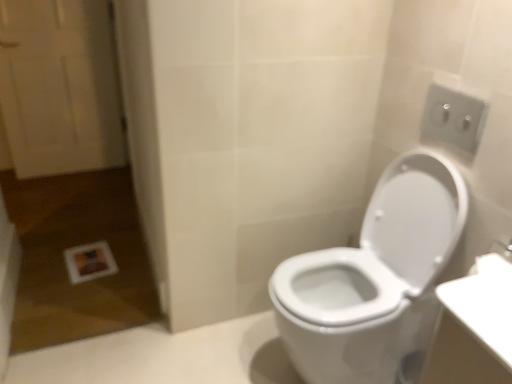
Question: Does white plastic outlet at upper right contain white glossy toilet at right?

Choices:
 (A) yes
 (B) no

Answer: (B)

Question: Is white plastic outlet at upper right positioned behind white glossy toilet at right?

Choices:
 (A) no
 (B) yes

Answer: (B)

Question: Is white plastic outlet at upper right facing towards white glossy toilet at right?

Choices:
 (A) yes
 (B) no

Answer: (B)

Question: Is white glossy toilet at right at the back of white plastic outlet at upper right?

Choices:
 (A) yes
 (B) no

Answer: (B)

Question: Does white plastic outlet at upper right have a greater height compared to white glossy toilet at right?

Choices:
 (A) yes
 (B) no

Answer: (B)

Question: Is white wooden door at left taller or shorter than white plastic outlet at upper right?

Choices:
 (A) tall
 (B) short

Answer: (A)

Question: From the image's perspective, relative to white plastic outlet at upper right, is white wooden door at left above or below?

Choices:
 (A) above
 (B) below

Answer: (A)

Question: Relative to white plastic outlet at upper right, is white wooden door at left in front or behind?

Choices:
 (A) behind
 (B) front

Answer: (A)

Question: Is white wooden door at left wider or thinner than white plastic outlet at upper right?

Choices:
 (A) wide
 (B) thin

Answer: (A)

Question: Is point (312, 266) closer or farther from the camera than point (88, 86)?

Choices:
 (A) farther
 (B) closer

Answer: (B)

Question: In terms of width, does white glossy toilet at right look wider or thinner when compared to white wooden door at left?

Choices:
 (A) wide
 (B) thin

Answer: (A)

Question: Is white glossy toilet at right taller or shorter than white wooden door at left?

Choices:
 (A) tall
 (B) short

Answer: (B)

Question: From a real-world perspective, is white glossy toilet at right positioned above or below white wooden door at left?

Choices:
 (A) below
 (B) above

Answer: (A)

Question: Considering the positions of white glossy toilet at right and white plastic outlet at upper right in the image, is white glossy toilet at right taller or shorter than white plastic outlet at upper right?

Choices:
 (A) tall
 (B) short

Answer: (A)

Question: From the image's perspective, relative to white plastic outlet at upper right, is white glossy toilet at right above or below?

Choices:
 (A) above
 (B) below

Answer: (B)